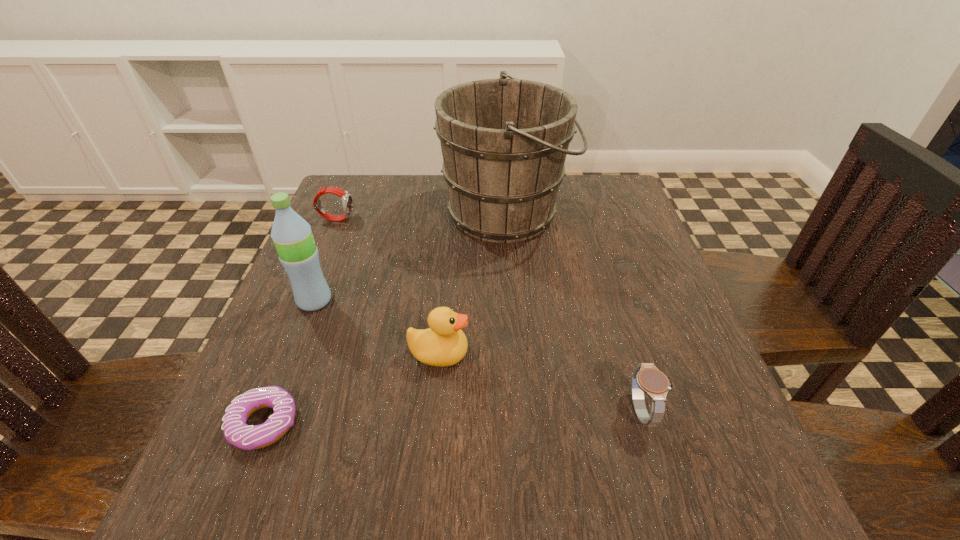
Identify the location of free space that is in between the bucket and the left watch. The width and height of the screenshot is (960, 540). (421, 216).

Find the location of a particular element. This screenshot has height=540, width=960. blank region between the left watch and the second tallest object is located at coordinates (325, 260).

Locate an element on the screen. free space between the left watch and the right watch is located at coordinates (489, 315).

Locate an element on the screen. free spot between the doughnut and the left watch is located at coordinates (300, 321).

The height and width of the screenshot is (540, 960). In order to click on vacant point located between the third farthest object and the tallest object in this screenshot , I will do `click(411, 257)`.

What are the coordinates of `empty space that is in between the nearer watch and the tallest object` in the screenshot? It's located at (574, 312).

Where is `vacant area that lies between the duck and the water bottle`? The height and width of the screenshot is (540, 960). vacant area that lies between the duck and the water bottle is located at coordinates (377, 327).

Where is `vacant region between the tallest object and the duck`? The width and height of the screenshot is (960, 540). vacant region between the tallest object and the duck is located at coordinates (472, 284).

This screenshot has width=960, height=540. I want to click on free space between the shortest object and the bucket, so click(x=386, y=318).

Locate an element on the screen. Image resolution: width=960 pixels, height=540 pixels. unoccupied position between the tallest object and the farther watch is located at coordinates (421, 216).